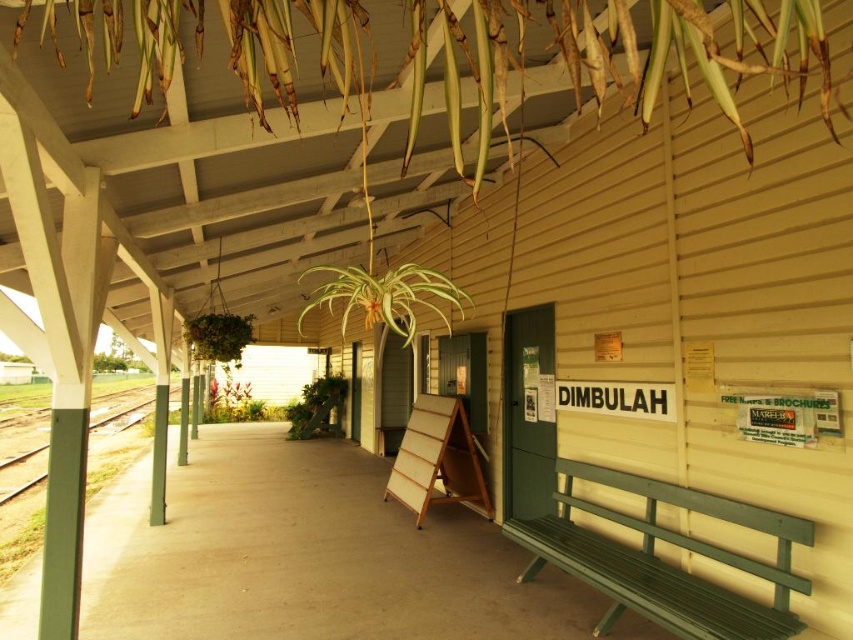
You are standing on the platform at DIMBULAH station and want to water the green leafy plant at upper left. You have a watering can that can hold 3 liters of water. Each trip you can carry the can full. The nearest water tap is 3.45 meters away from you. How many trips do you need to make to water the plant sufficiently if it requires 10 liters of water?

The green leafy plant at upper left requires 10 liters of water. Each trip with the 3 liter can allows you to carry 3 liters. 10 divided by 3 is approximately 3.33, so you would need 4 trips to provide enough water. The distance to the tap and back isn

You are standing on the DIMBULAH station platform and want to find the green leafy plant at upper left. According to the coordinates provided, where should you look to locate it?

The green leafy plant at upper left is located at coordinates point (218, 337), so you should look towards the upper left area of the platform to find it.

You are standing at the entrance of the platform and want to sit down. Where is the green wooden bench at lower right located relative to your position?

The green wooden bench at lower right is located at point (664, 561), which is to the lower right of your current position at the entrance.